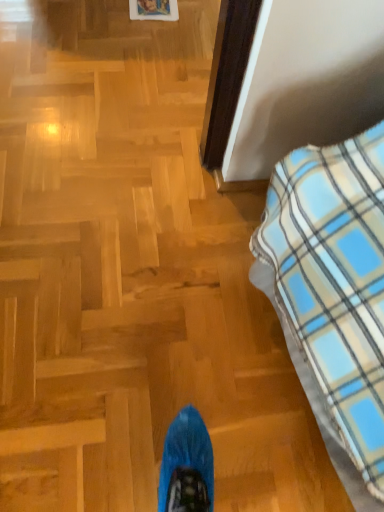
Question: From a real-world perspective, is wooden picture frame at upper center under blue plaid blanket at right?

Choices:
 (A) yes
 (B) no

Answer: (A)

Question: Is wooden picture frame at upper center to the right of blue plaid blanket at right from the viewer's perspective?

Choices:
 (A) yes
 (B) no

Answer: (B)

Question: Is wooden picture frame at upper center wider than blue plaid blanket at right?

Choices:
 (A) yes
 (B) no

Answer: (B)

Question: Considering the relative sizes of wooden picture frame at upper center and blue plaid blanket at right in the image provided, is wooden picture frame at upper center bigger than blue plaid blanket at right?

Choices:
 (A) no
 (B) yes

Answer: (A)

Question: Are wooden picture frame at upper center and blue plaid blanket at right located far from each other?

Choices:
 (A) no
 (B) yes

Answer: (B)

Question: Is wooden picture frame at upper center surrounding blue plaid blanket at right?

Choices:
 (A) yes
 (B) no

Answer: (B)

Question: From a real-world perspective, is blue plaid blanket at right over wooden picture frame at upper center?

Choices:
 (A) yes
 (B) no

Answer: (A)

Question: Could wooden picture frame at upper center be considered to be inside blue plaid blanket at right?

Choices:
 (A) no
 (B) yes

Answer: (A)

Question: Does blue plaid blanket at right appear on the left side of wooden picture frame at upper center?

Choices:
 (A) yes
 (B) no

Answer: (B)

Question: From the image's perspective, would you say blue plaid blanket at right is shown under wooden picture frame at upper center?

Choices:
 (A) no
 (B) yes

Answer: (B)

Question: Could you tell me if blue plaid blanket at right is turned towards wooden picture frame at upper center?

Choices:
 (A) yes
 (B) no

Answer: (B)

Question: Is blue plaid blanket at right taller than wooden picture frame at upper center?

Choices:
 (A) no
 (B) yes

Answer: (B)

Question: Considering their positions, is wooden picture frame at upper center located in front of or behind blue plaid blanket at right?

Choices:
 (A) behind
 (B) front

Answer: (A)